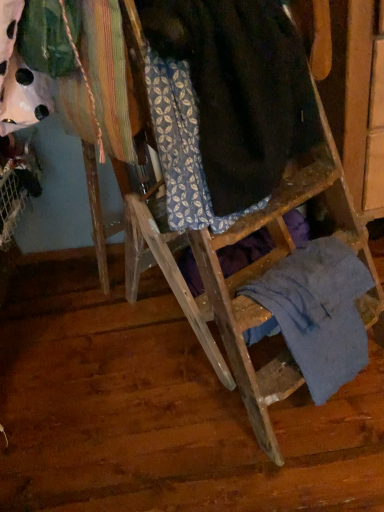
Locate an element on the screen. This screenshot has width=384, height=512. empty space that is ontop of blue cotton shirt at lower right is located at coordinates (308, 260).